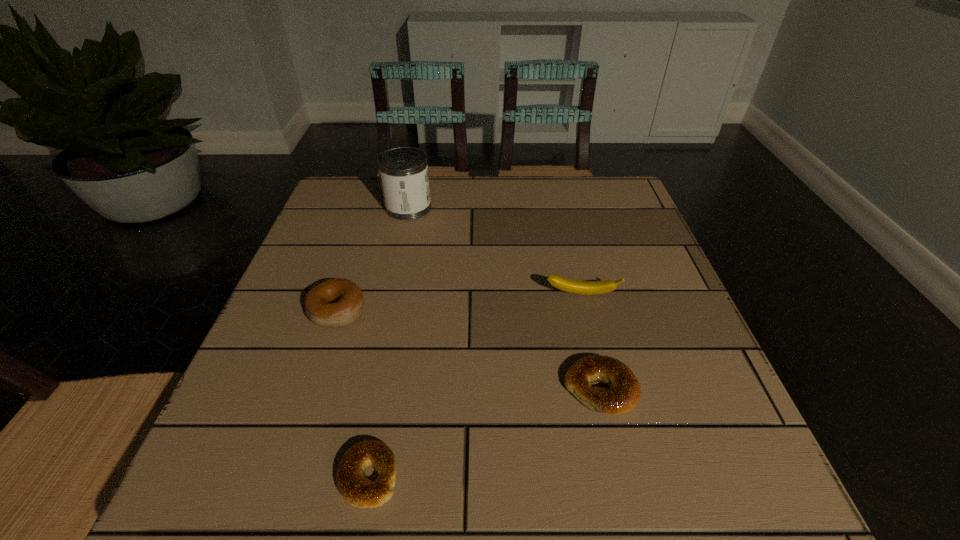
This screenshot has height=540, width=960. In order to click on can in this screenshot , I will do `click(403, 171)`.

Where is `the farthest object`? the farthest object is located at coordinates (403, 171).

Identify the location of banana. Image resolution: width=960 pixels, height=540 pixels. (572, 286).

Find the location of a particular element. This screenshot has height=540, width=960. the leftmost bagel is located at coordinates [333, 303].

You are a GUI agent. You are given a task and a screenshot of the screen. Output one action in this format:
    pyautogui.click(x=<x>, y=<y>)
    Task: Click on the tallest bagel
    The width and height of the screenshot is (960, 540).
    Given the screenshot: What is the action you would take?
    pyautogui.click(x=333, y=303)

Find the location of a particular element. The height and width of the screenshot is (540, 960). the fourth tallest object is located at coordinates (624, 391).

Find the location of a particular element. the second nearest object is located at coordinates (624, 391).

Find the location of a particular element. the shortest object is located at coordinates (356, 489).

This screenshot has width=960, height=540. In order to click on the shortest bagel in this screenshot , I will do `click(356, 489)`.

You are a GUI agent. You are given a task and a screenshot of the screen. Output one action in this format:
    pyautogui.click(x=<x>, y=<y>)
    Task: Click on the free space located 0.390m on the front of the tallest object
    
    Given the screenshot: What is the action you would take?
    pyautogui.click(x=379, y=341)